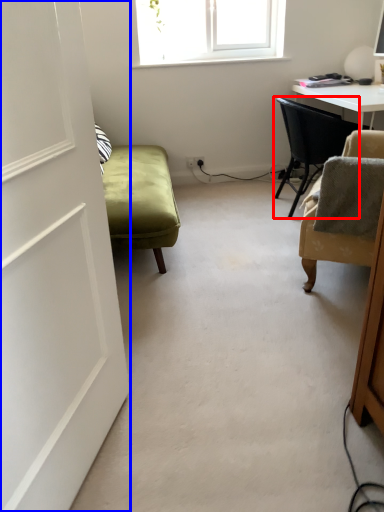
Question: Which object is further to the camera taking this photo, chair (highlighted by a red box) or door (highlighted by a blue box)?

Choices:
 (A) chair
 (B) door

Answer: (A)